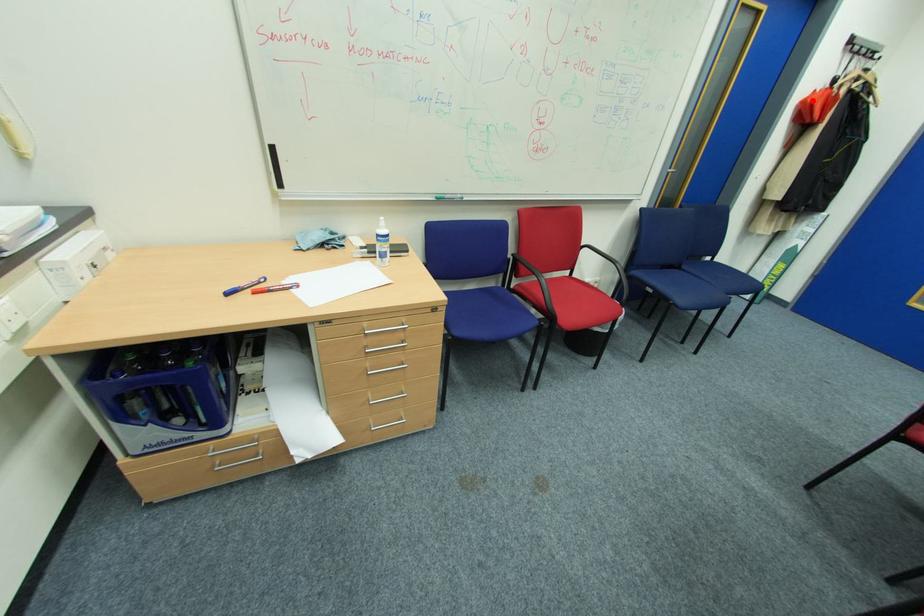
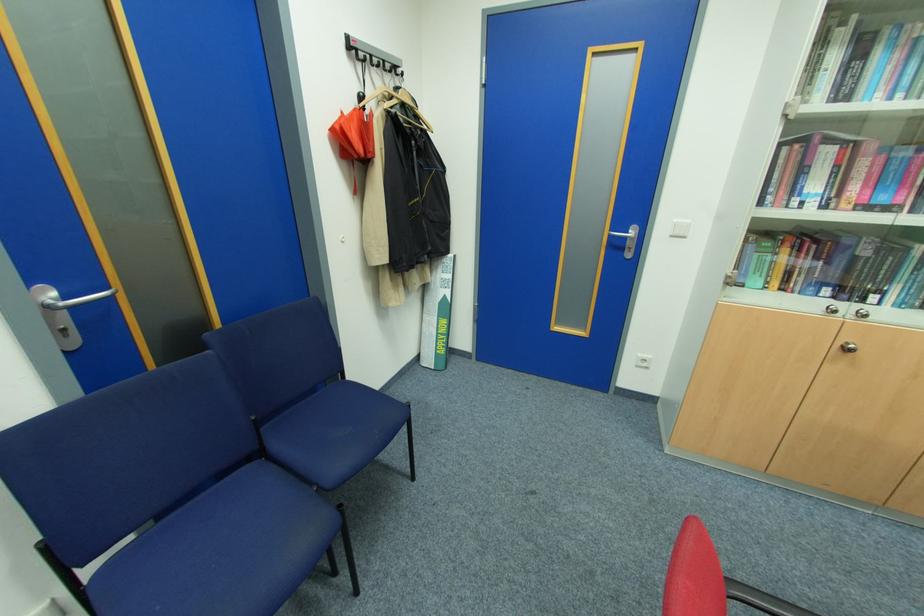
Question: I am providing you with two images of the same scene from different viewpoints. In image1, a red point is highlighted. Considering the same 3D point in image2, which of the following is correct?

Choices:
 (A) It is closer
 (B) It is farther

Answer: (A)